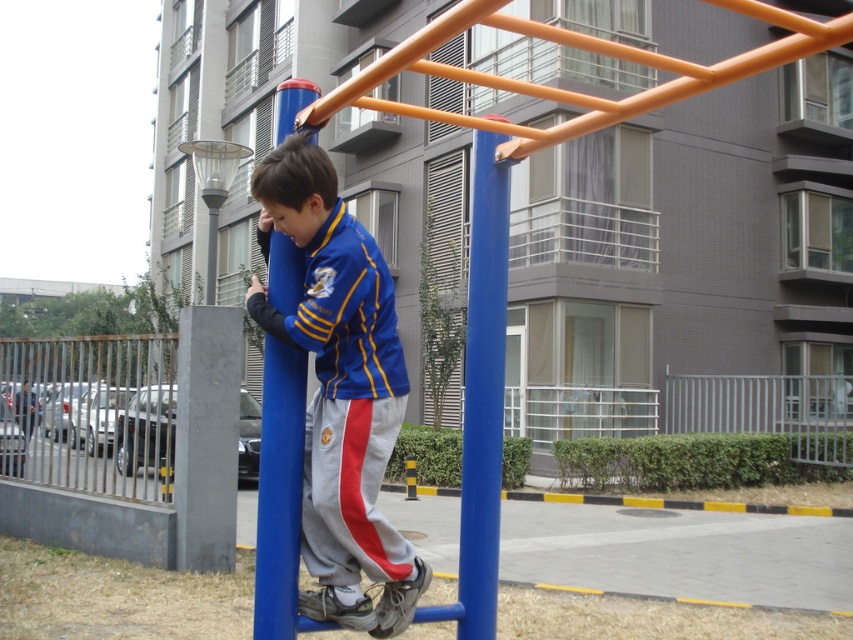
Question: Where is blue smooth pole at center located in relation to blue plastic pole at center in the image?

Choices:
 (A) above
 (B) below

Answer: (A)

Question: Does blue smooth pole at center have a greater width compared to blue plastic pole at center?

Choices:
 (A) no
 (B) yes

Answer: (B)

Question: Which point is farther from the camera taking this photo?

Choices:
 (A) (294, 584)
 (B) (300, 547)

Answer: (B)

Question: Observing the image, what is the correct spatial positioning of blue fabric jacket at center in reference to blue plastic pole at center?

Choices:
 (A) below
 (B) above

Answer: (B)

Question: Which is nearer to the blue plastic pole at center?

Choices:
 (A) blue smooth pole at center
 (B) blue fabric jacket at center

Answer: (B)

Question: Which point is closer to the camera?

Choices:
 (A) blue smooth pole at center
 (B) blue fabric jacket at center

Answer: (B)